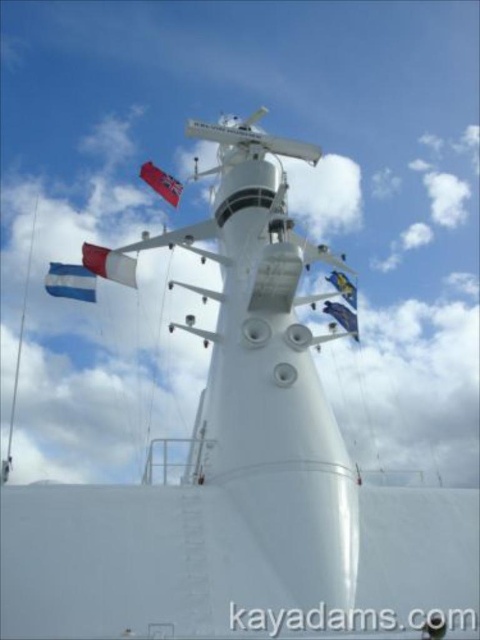
Question: Which of the following is the closest to the observer?

Choices:
 (A) blue fabric flag at left
 (B) blue fabric flag at upper center
 (C) red fabric flag at upper center
 (D) blue fabric flag at upper right

Answer: (A)

Question: Considering the relative positions of blue fabric flag at upper center and blue fabric flag at upper right in the image provided, where is blue fabric flag at upper center located with respect to blue fabric flag at upper right?

Choices:
 (A) left
 (B) right

Answer: (A)

Question: Observing the image, what is the correct spatial positioning of blue fabric flag at left in reference to white fabric flag at center?

Choices:
 (A) below
 (B) above

Answer: (A)

Question: Among these objects, which one is nearest to the camera?

Choices:
 (A) blue fabric flag at left
 (B) white fabric flag at center
 (C) blue fabric flag at upper right
 (D) red fabric flag at upper center

Answer: (A)

Question: Which object appears closest to the camera in this image?

Choices:
 (A) white fabric flag at center
 (B) red fabric flag at upper center
 (C) blue fabric flag at upper center
 (D) blue fabric flag at upper right

Answer: (C)

Question: Does blue fabric flag at left appear under red fabric flag at upper center?

Choices:
 (A) yes
 (B) no

Answer: (A)